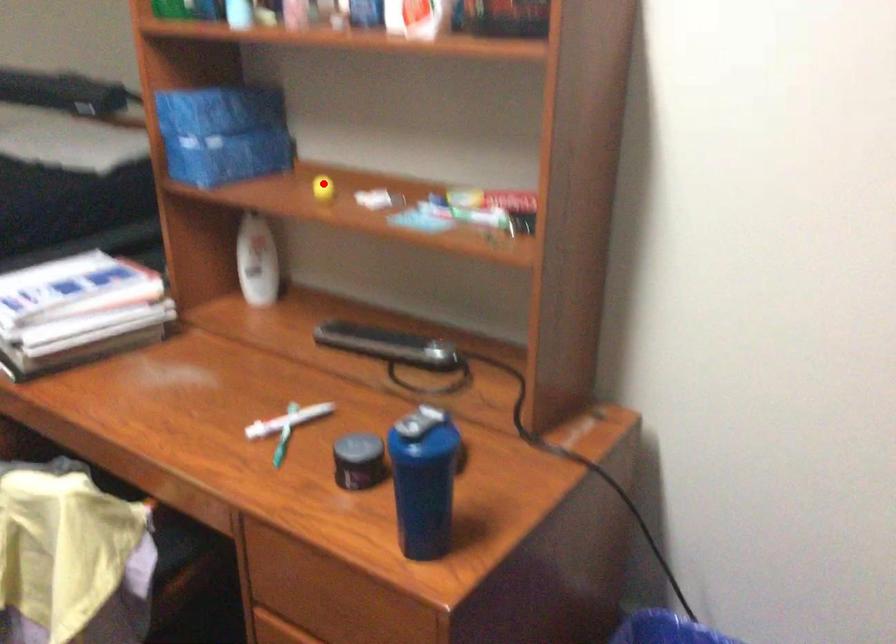
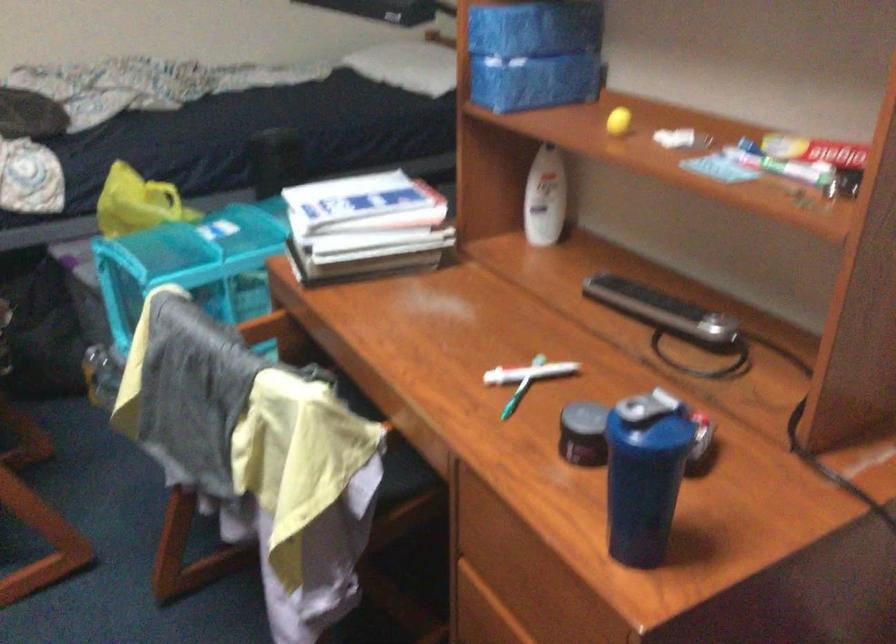
The point at the highlighted location is marked in the first image. Where is the corresponding point in the second image?

(617, 120)